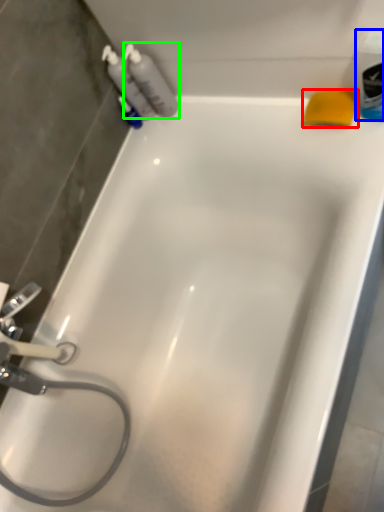
Question: Which object is positioned farthest from soap (highlighted by a red box)? Select from mouthwash (highlighted by a blue box) and cleaning product (highlighted by a green box).

Choices:
 (A) mouthwash
 (B) cleaning product

Answer: (B)